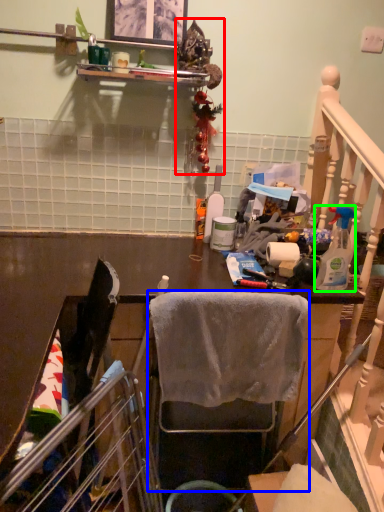
Question: Which object is positioned closest to christmas decoration (highlighted by a red box)? Select from chair (highlighted by a blue box) and bottle (highlighted by a green box).

Choices:
 (A) chair
 (B) bottle

Answer: (B)